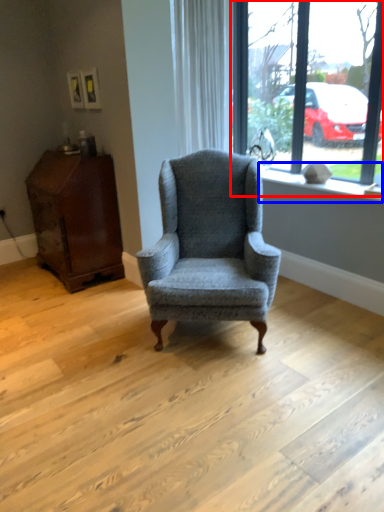
Question: Which of the following is the farthest to the observer, window (highlighted by a red box) or window sill (highlighted by a blue box)?

Choices:
 (A) window
 (B) window sill

Answer: (B)